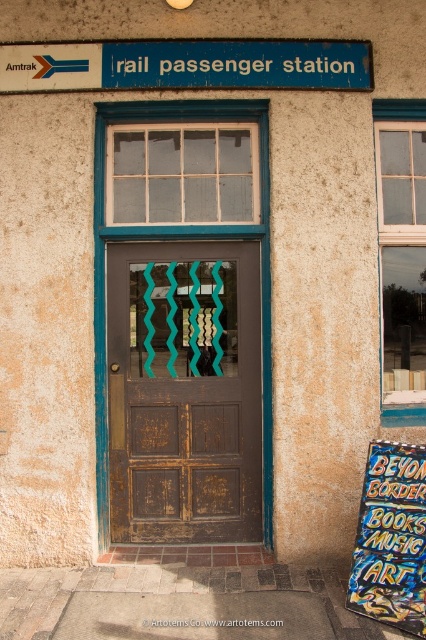
Question: In this image, where is brown wooden door at center located relative to blue painted metal signboard at upper center?

Choices:
 (A) above
 (B) below

Answer: (B)

Question: Which point is closer to the camera?

Choices:
 (A) brown wooden door at center
 (B) blue painted metal signboard at upper center

Answer: (B)

Question: Can you confirm if brown wooden door at center is positioned to the right of blue painted metal signboard at upper center?

Choices:
 (A) yes
 (B) no

Answer: (B)

Question: Can you confirm if brown wooden door at center is positioned to the left of blue painted metal signboard at upper center?

Choices:
 (A) no
 (B) yes

Answer: (B)

Question: Which point is farther to the camera?

Choices:
 (A) brown wooden door at center
 (B) blue painted metal signboard at upper center

Answer: (A)